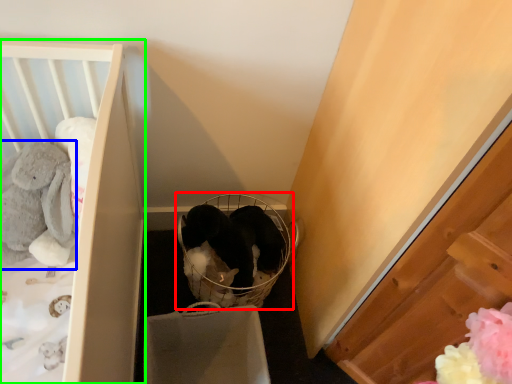
Question: Which is nearer to the baby carriage (highlighted by a red box)? animal (highlighted by a blue box) or furniture (highlighted by a green box).

Choices:
 (A) animal
 (B) furniture

Answer: (B)